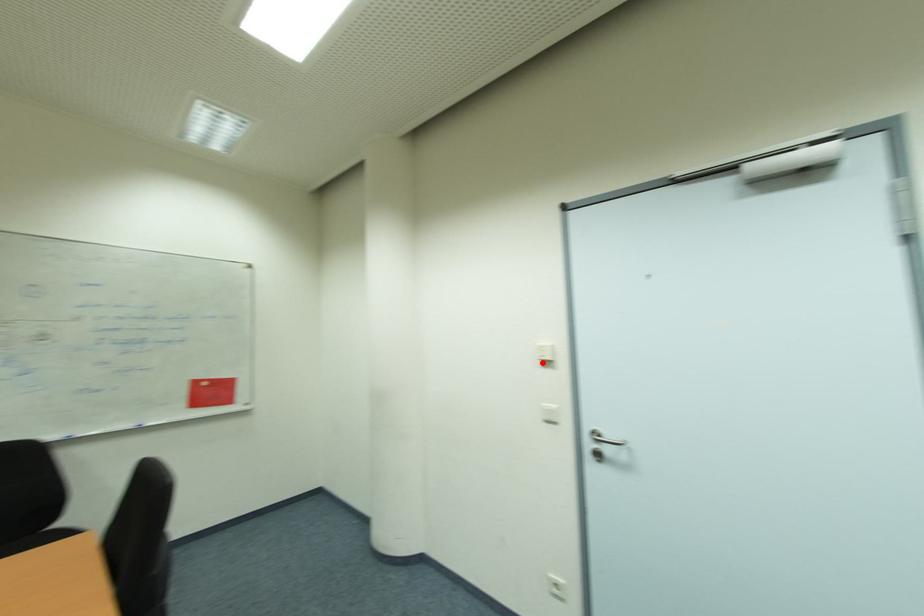
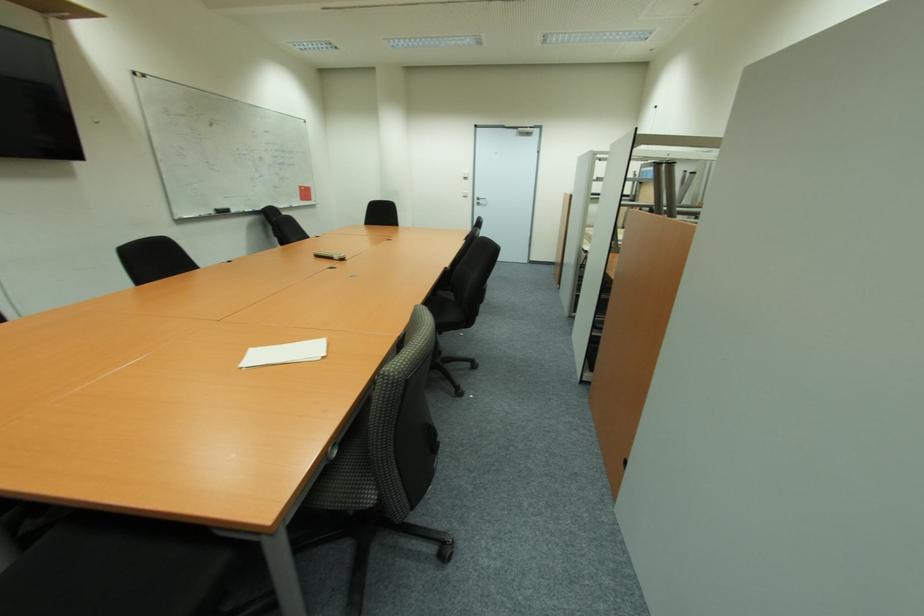
In the second image, find the point that corresponds to the highlighted location in the first image.

(467, 179)